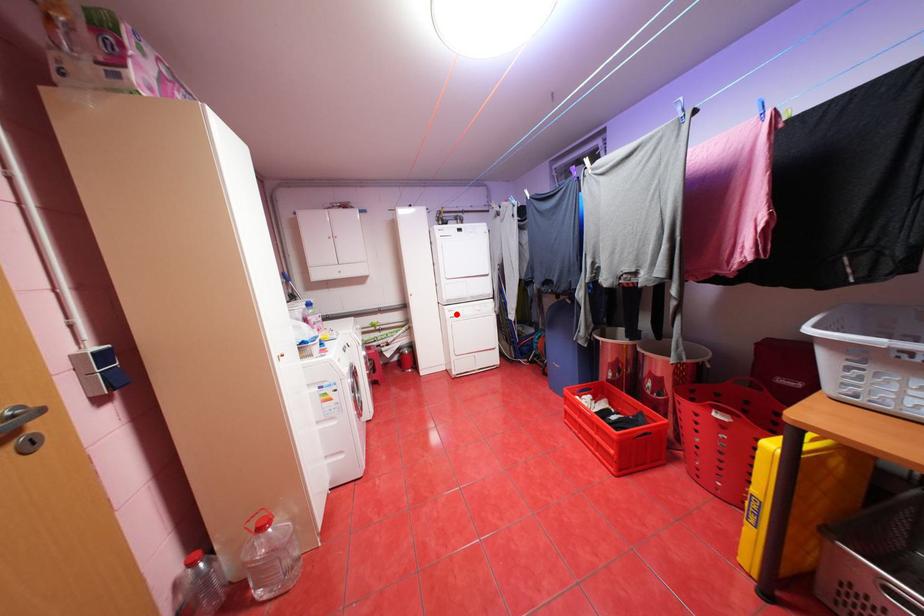
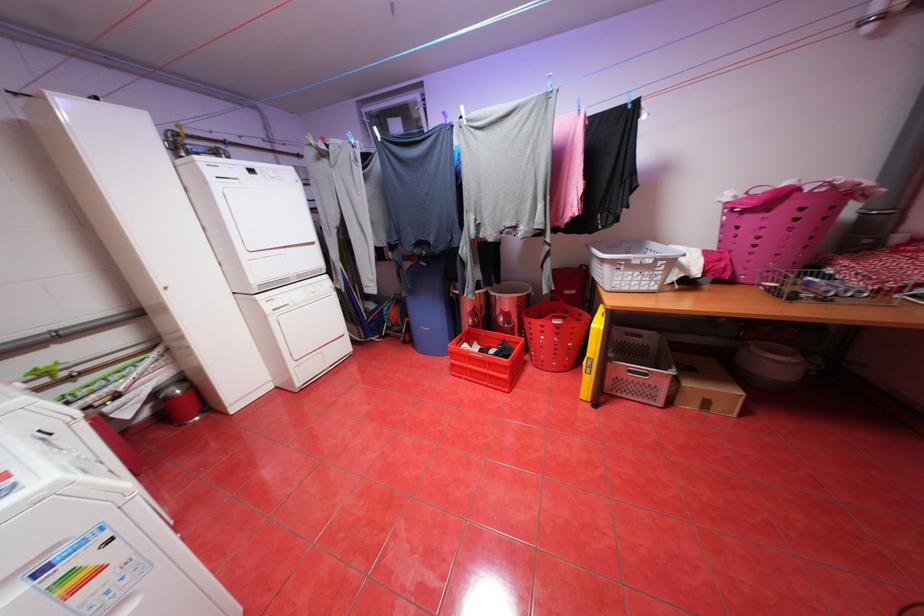
Where in the second image is the point corresponding to the highlighted location from the first image?

(275, 307)